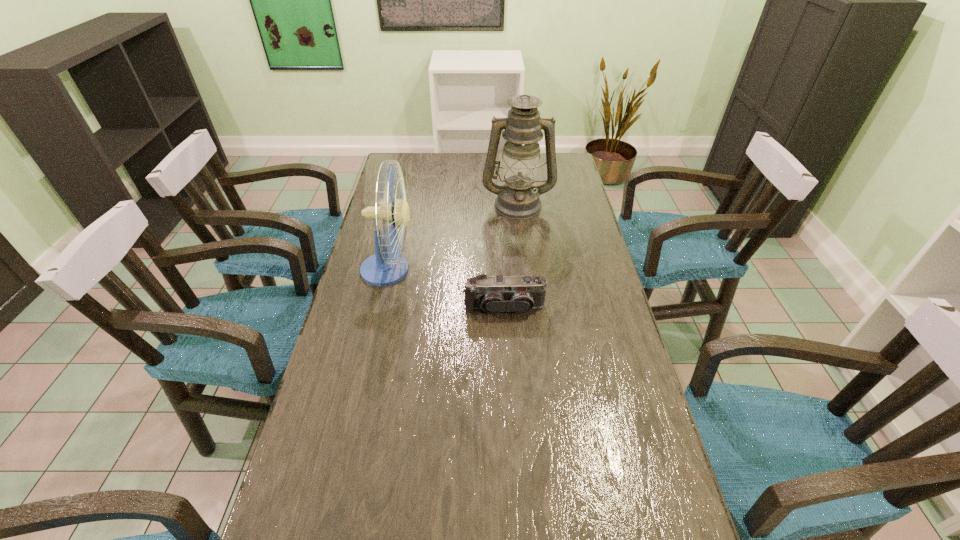
In the image, there is a desktop. Identify the location of vacant space at the far left corner. This screenshot has width=960, height=540. (408, 171).

Find the location of a particular element. This screenshot has width=960, height=540. vacant space that is in between the fan and the farthest object is located at coordinates (453, 237).

Find the location of `vacant space that's between the farthest object and the shortest object`. vacant space that's between the farthest object and the shortest object is located at coordinates (511, 256).

The width and height of the screenshot is (960, 540). I want to click on vacant space that's between the oil lamp and the camcorder, so click(x=511, y=256).

Where is `blank region between the oil lamp and the camcorder`? The width and height of the screenshot is (960, 540). blank region between the oil lamp and the camcorder is located at coordinates (511, 256).

The height and width of the screenshot is (540, 960). Find the location of `blank region between the leftmost object and the oil lamp`. blank region between the leftmost object and the oil lamp is located at coordinates (453, 237).

You are a GUI agent. You are given a task and a screenshot of the screen. Output one action in this format:
    pyautogui.click(x=<x>, y=<y>)
    Task: Click on the free spot between the fan and the shortest object
    
    Given the screenshot: What is the action you would take?
    446,289

Identify the location of free point between the shortest object and the fan. (446, 289).

Where is `vacant area between the camcorder and the farthest object`? The image size is (960, 540). vacant area between the camcorder and the farthest object is located at coordinates (511, 256).

Locate which object is the second closest to the camcorder. Please provide its 2D coordinates. Your answer should be formatted as a tuple, i.e. [(x, y)], where the tuple contains the x and y coordinates of a point satisfying the conditions above.

[(518, 198)]